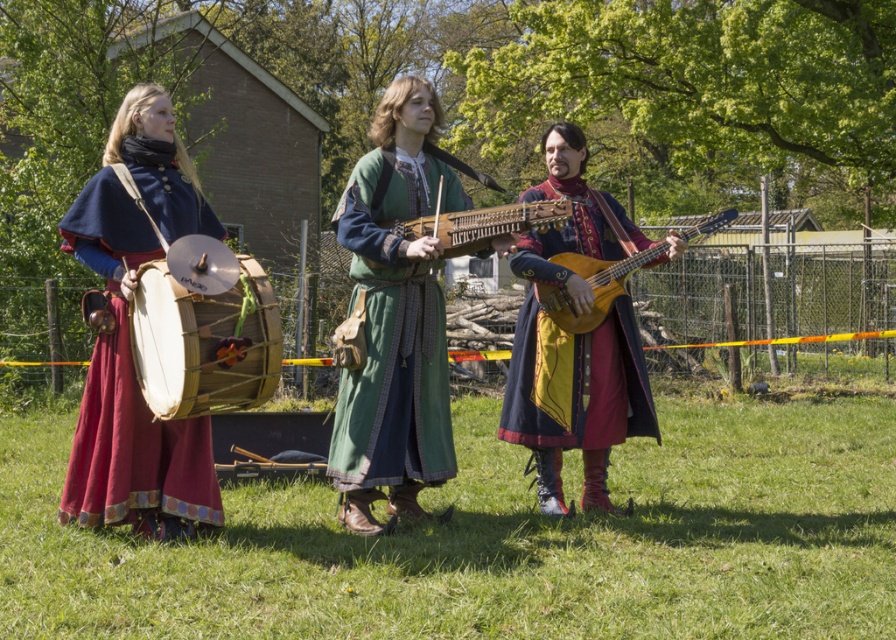
Is velvet blue cape at left smaller than natural wood drum at left?

Incorrect, velvet blue cape at left is not smaller in size than natural wood drum at left.

Is velvet blue cape at left wider than natural wood drum at left?

Indeed, velvet blue cape at left has a greater width compared to natural wood drum at left.

Describe the element at coordinates (134, 448) in the screenshot. I see `velvet blue cape at left` at that location.

You are a GUI agent. You are given a task and a screenshot of the screen. Output one action in this format:
    pyautogui.click(x=<x>, y=<y>)
    Task: Click on the velvet blue cape at left
    This screenshot has width=896, height=640.
    Given the screenshot: What is the action you would take?
    pyautogui.click(x=134, y=448)

Does green woolen tunic at center have a smaller size compared to wooden stringed instrument at center?

No.

Who is more distant from viewer, (418, 321) or (419, 230)?

Positioned behind is point (418, 321).

Locate an element on the screen. The width and height of the screenshot is (896, 640). green woolen tunic at center is located at coordinates (392, 340).

Does velvet blue coat at center appear on the right side of wooden acoustic guitar at center?

Incorrect, velvet blue coat at center is not on the right side of wooden acoustic guitar at center.

Who is more distant from viewer, [576,394] or [583,323]?

The point [576,394] is more distant.

Measure the distance between velvet blue coat at center and camera.

They are 6.65 meters apart.

At what (x,y) coordinates should I click in order to perform the action: click on velvet blue coat at center. Please return your answer as a coordinate pair (x, y). Looking at the image, I should click on (576, 381).